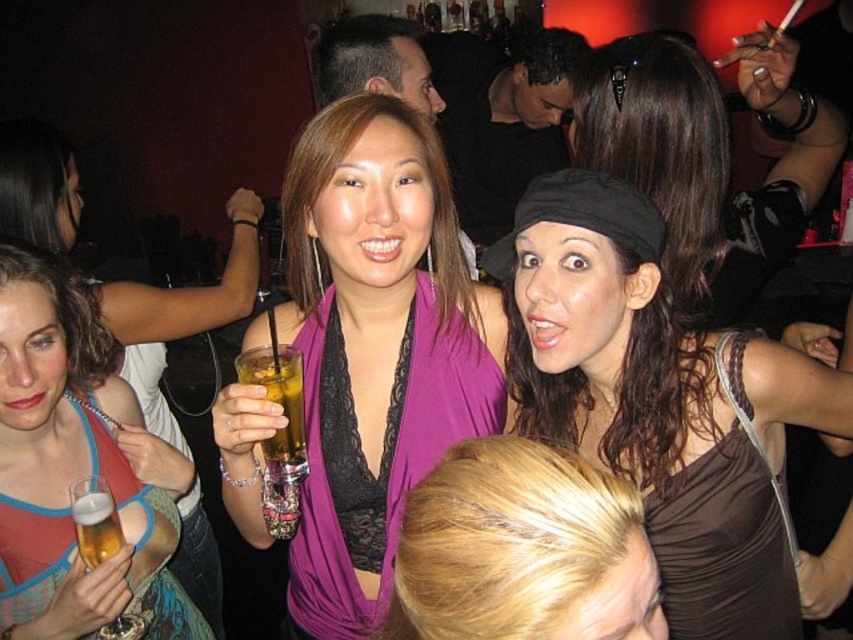
You are a photographer at the nightclub scene. You want to take a photo of the purple satin scarf at center. Where should you point your camera to capture it?

You should point your camera at point 0.544 on the x axis and 0.441 on the y axis to capture the purple satin scarf at center.

You are a photographer at the event and want to capture a photo that includes both the brown satin dress at center and the translucent glass beer at lower left. Which object should you focus on first to ensure both are in sharp focus?

You should focus on the brown satin dress at center first because it is closer to the viewer than the translucent glass beer at lower left. By focusing on the closer object, the farther one may still be in acceptable focus depending on the depth of field.

You are a photographer at the event and want to capture a photo that highlights both the purple satin scarf at center and the shiny black hat at center. Which object should you focus on first if you want to ensure both are in frame without moving the camera?

The purple satin scarf at center is taller than the shiny black hat at center, so focusing on the purple satin scarf at center first will help ensure both objects are within the camera frame without needing to adjust the camera position.